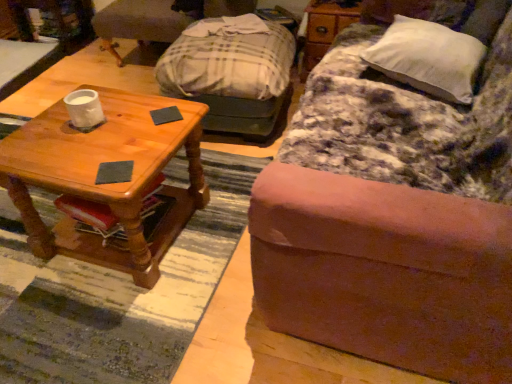
Identify the location of vacant space in between white marble cup at center left and dark gray matte coaster at center, acting as the 1th pad starting from the top. (128, 118).